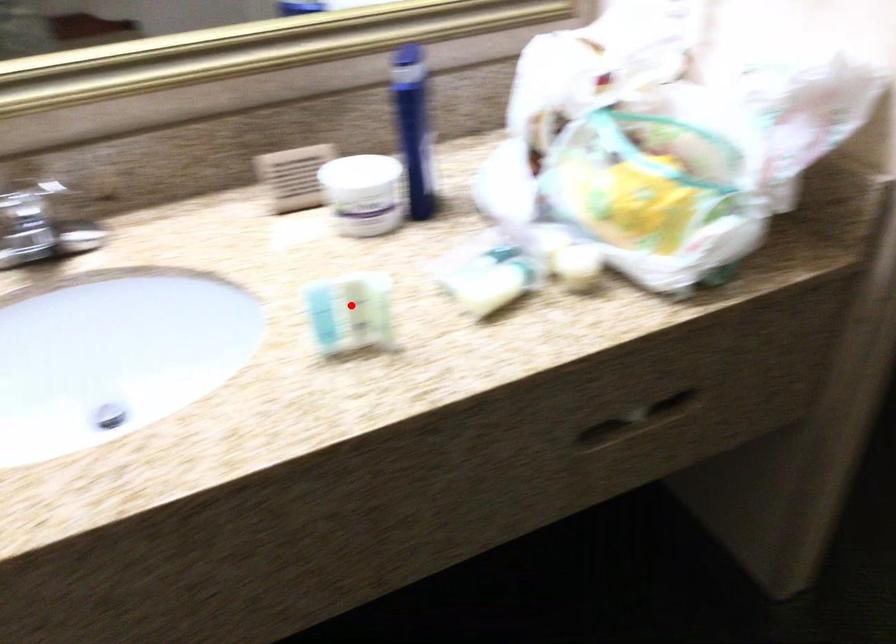
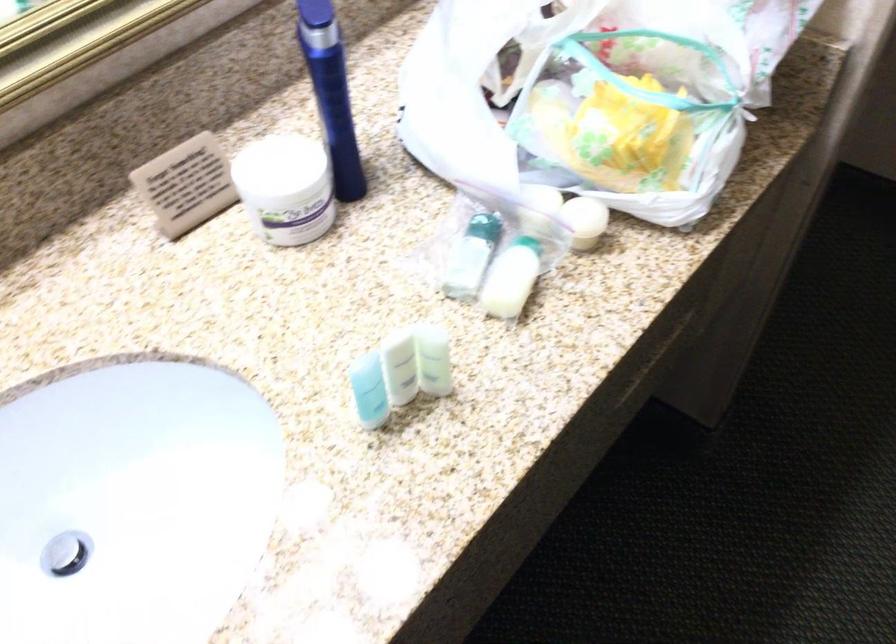
Question: I am providing you with two images of the same scene from different viewpoints. A red point is shown in image1. For the corresponding object point in image2, is it positioned nearer or farther from the camera?

Choices:
 (A) Nearer
 (B) Farther

Answer: (A)